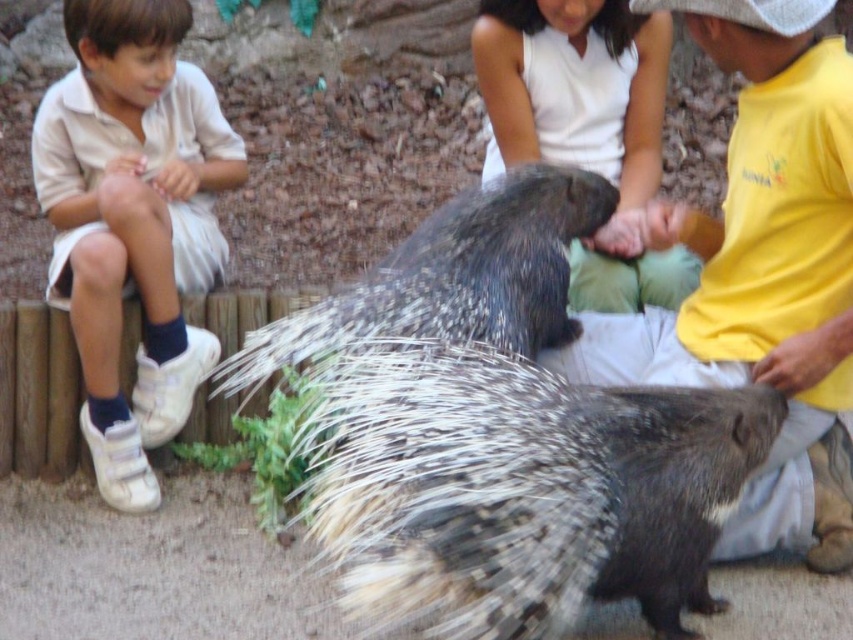
Question: Observing the image, what is the correct spatial positioning of white cotton shirt at left in reference to white cotton shirt at center?

Choices:
 (A) below
 (B) above

Answer: (A)

Question: Can you confirm if yellow cotton shirt at center is bigger than white cotton shirt at left?

Choices:
 (A) yes
 (B) no

Answer: (A)

Question: Which is farther from the spiky fur hedgehog at center?

Choices:
 (A) white cotton shirt at center
 (B) white cotton shirt at left

Answer: (B)

Question: Estimate the real-world distances between objects in this image. Which object is farther from the white cotton shirt at center?

Choices:
 (A) white cotton shirt at left
 (B) yellow cotton shirt at center
 (C) spiky fur hedgehog at center

Answer: (A)

Question: Can you confirm if spiky fur hedgehog at center is positioned above white cotton shirt at center?

Choices:
 (A) yes
 (B) no

Answer: (B)

Question: Which point is farther from the camera taking this photo?

Choices:
 (A) (607, 138)
 (B) (752, 29)

Answer: (A)